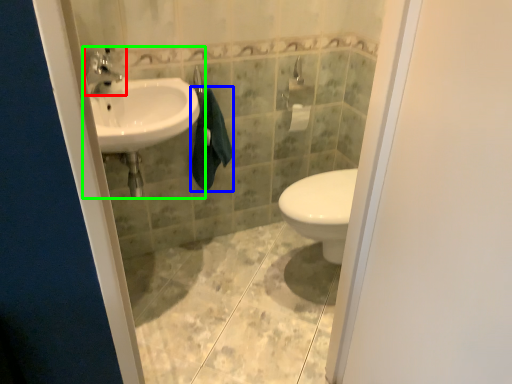
Question: Which is nearer to the tap (highlighted by a red box)? bath towel (highlighted by a blue box) or sink (highlighted by a green box).

Choices:
 (A) bath towel
 (B) sink

Answer: (B)